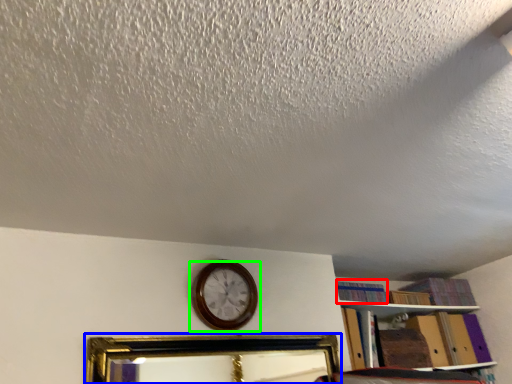
Question: Considering the real-world distances, which object is closest to book (highlighted by a red box)? picture frame (highlighted by a blue box) or wall clock (highlighted by a green box).

Choices:
 (A) picture frame
 (B) wall clock

Answer: (B)